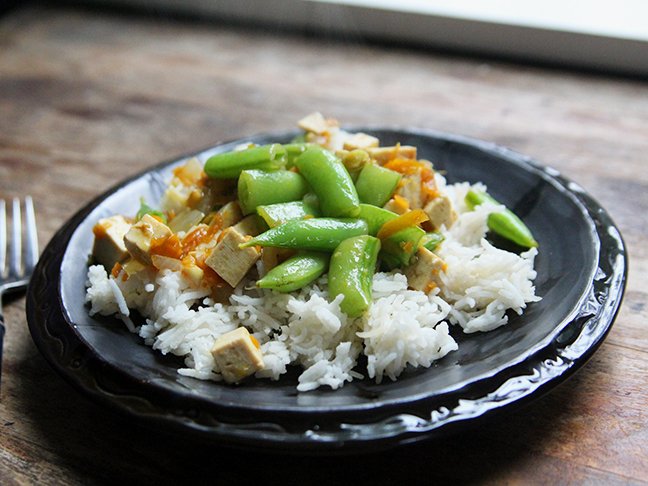
This screenshot has height=486, width=648. What are the coordinates of `black shadow cast by ceramic bowl` in the screenshot? It's located at (67, 411), (86, 447), (142, 458), (218, 457), (295, 463), (402, 459), (494, 448), (542, 412).